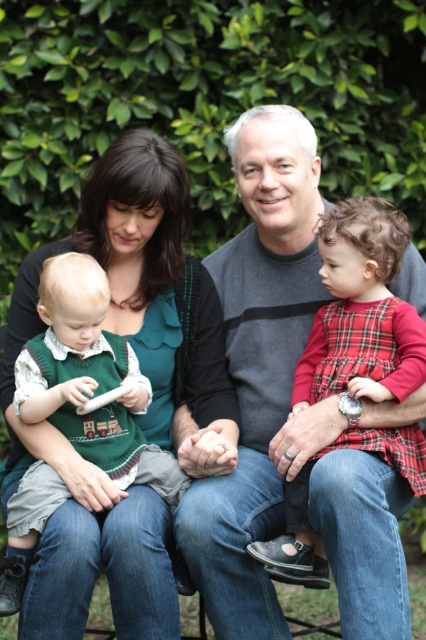
Is green matte dress at center further to camera compared to green knitted vest at left?

No, green matte dress at center is in front of green knitted vest at left.

Who is more distant from viewer, (154, 404) or (97, 388)?

The point (154, 404) is more distant.

Identify the location of green matte dress at center. (140, 416).

Which is above, green matte dress at center or plaid fabric dress at center?

Positioned higher is green matte dress at center.

Where is `green matte dress at center`? The width and height of the screenshot is (426, 640). green matte dress at center is located at coordinates point(140,416).

Is plaid fabric dress at center to the left of green knitted vest at left from the viewer's perspective?

In fact, plaid fabric dress at center is to the right of green knitted vest at left.

Does plaid fabric dress at center have a greater width compared to green knitted vest at left?

Correct, the width of plaid fabric dress at center exceeds that of green knitted vest at left.

Does point (382, 304) come closer to viewer compared to point (92, 294)?

No, it is behind (92, 294).

Where is `plaid fabric dress at center`? The height and width of the screenshot is (640, 426). plaid fabric dress at center is located at coordinates (362, 310).